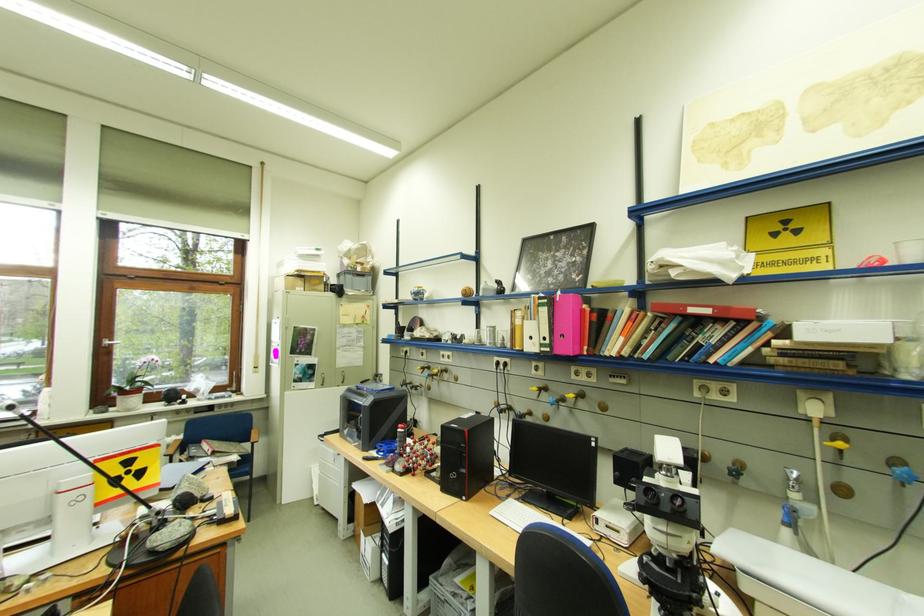
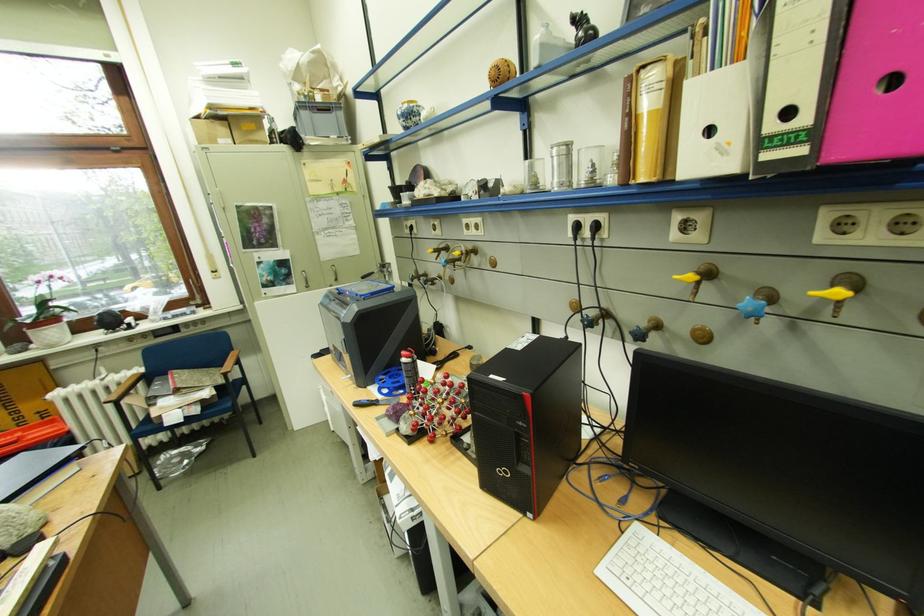
The point at (130, 399) is marked in the first image. Where is the corresponding point in the second image?

(41, 334)